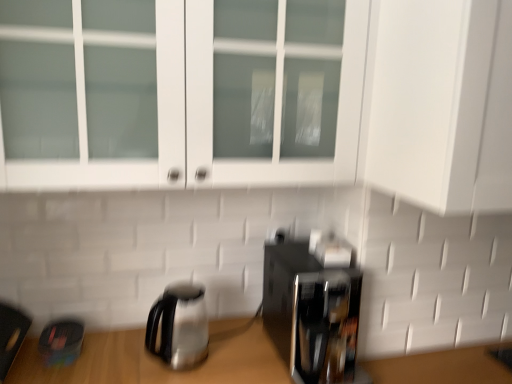
I want to click on vacant point to the left of black glossy coffee maker at lower right, so (243, 356).